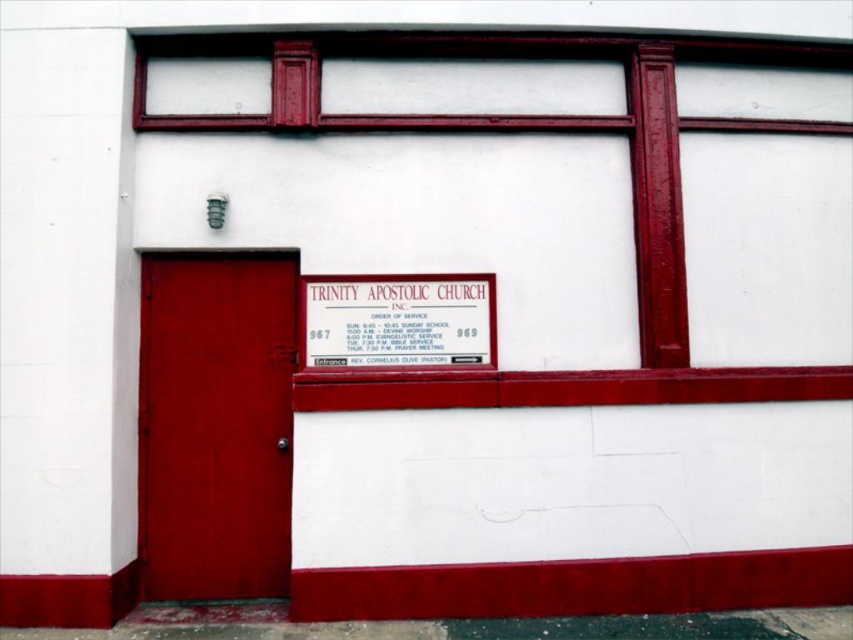
From the picture: Who is shorter, white matte sign at upper center or metallic gold sign at center?

With less height is metallic gold sign at center.

How distant is white matte sign at upper center from metallic gold sign at center?

white matte sign at upper center and metallic gold sign at center are 1.01 meters apart.

Between point (703, 42) and point (471, 305), which one is positioned behind?

Point (703, 42)

Identify the location of white matte sign at upper center. (531, 128).

Who is positioned more to the left, matte red door at left or white matte sign at upper center?

Positioned to the left is matte red door at left.

Between point (198, 516) and point (428, 36), which one is positioned in front?

Point (198, 516)

Is point (260, 518) positioned after point (637, 124)?

No, it is not.

Locate an element on the screen. matte red door at left is located at coordinates (215, 424).

This screenshot has width=853, height=640. Describe the element at coordinates (215, 424) in the screenshot. I see `matte red door at left` at that location.

Does matte red door at left have a larger size compared to metallic gold sign at center?

Correct, matte red door at left is larger in size than metallic gold sign at center.

The width and height of the screenshot is (853, 640). What do you see at coordinates (215, 424) in the screenshot?
I see `matte red door at left` at bounding box center [215, 424].

Find the location of a particular element. The width and height of the screenshot is (853, 640). matte red door at left is located at coordinates (215, 424).